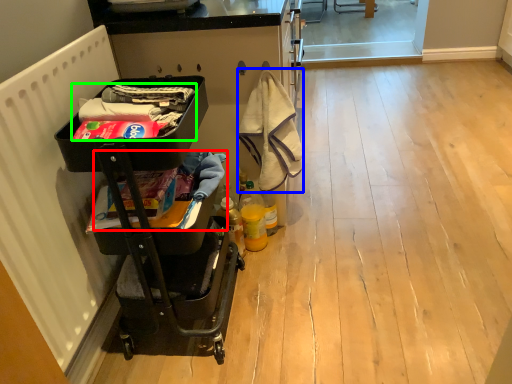
Question: Considering the real-world distances, which object is closest to laundry (highlighted by a red box)? material (highlighted by a blue box) or laundry (highlighted by a green box).

Choices:
 (A) material
 (B) laundry

Answer: (B)